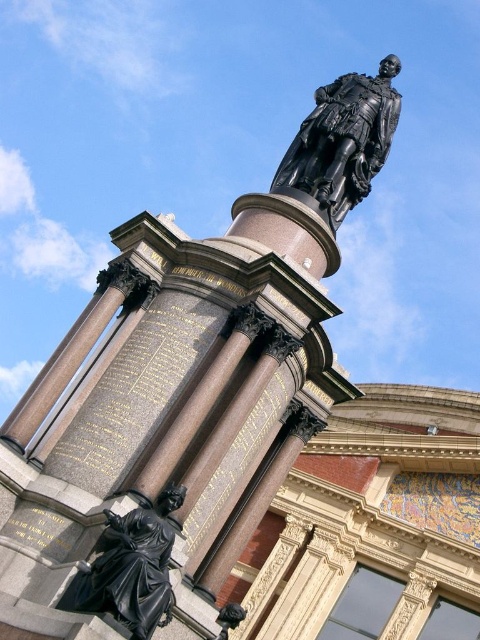
Question: Which object is closer to the camera taking this photo?

Choices:
 (A) black polished statue at lower left
 (B) bronze statue at upper center

Answer: (A)

Question: Is bronze statue at upper center positioned in front of black polished statue at lower left?

Choices:
 (A) yes
 (B) no

Answer: (B)

Question: Does bronze statue at upper center come in front of black polished statue at lower left?

Choices:
 (A) yes
 (B) no

Answer: (B)

Question: Among these objects, which one is nearest to the camera?

Choices:
 (A) black polished statue at lower left
 (B) bronze statue at upper center

Answer: (A)

Question: Which point is closer to the camera taking this photo?

Choices:
 (A) (96, 560)
 (B) (276, 189)

Answer: (A)

Question: Does bronze statue at upper center have a larger size compared to black polished statue at lower left?

Choices:
 (A) yes
 (B) no

Answer: (A)